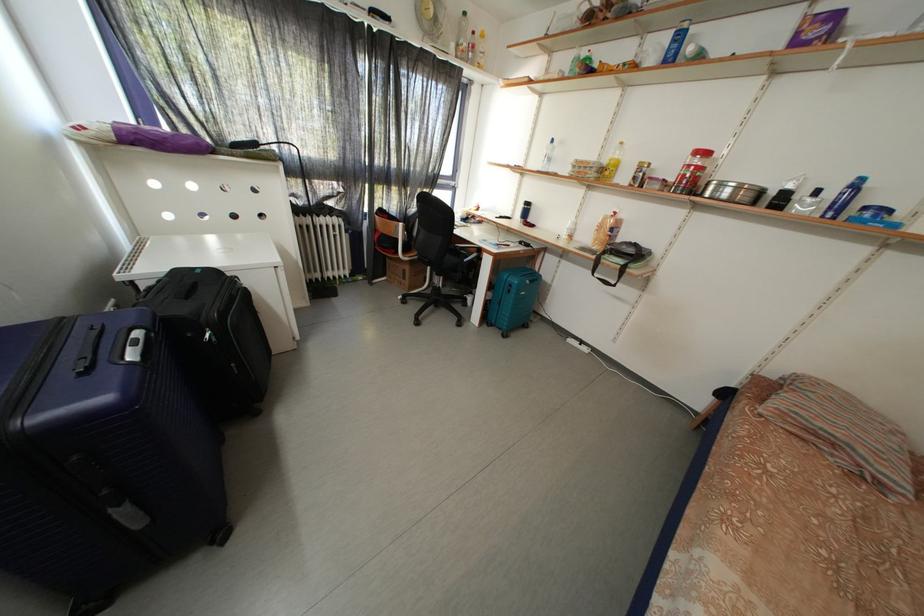
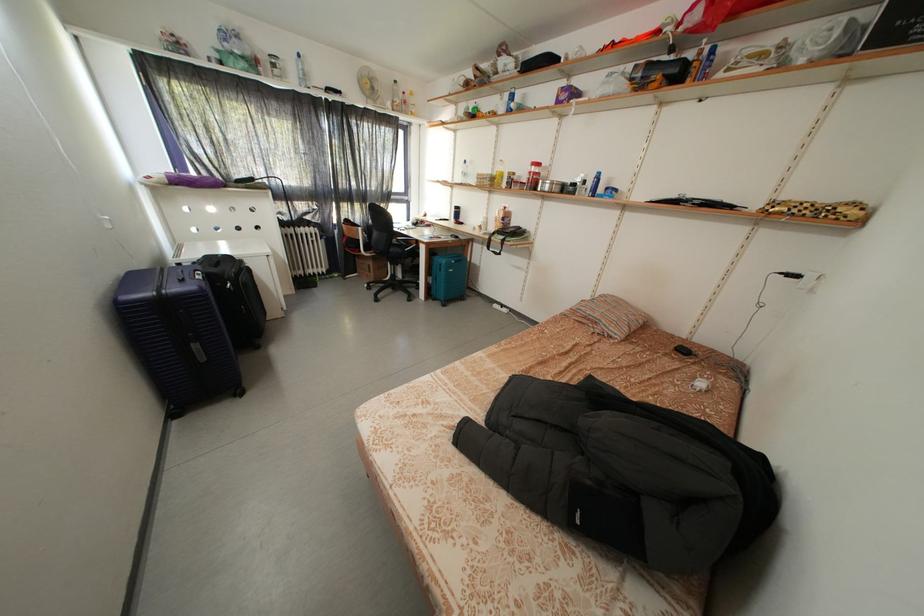
Find the pixel in the second image that matches point 734,199 in the first image.

(554, 193)